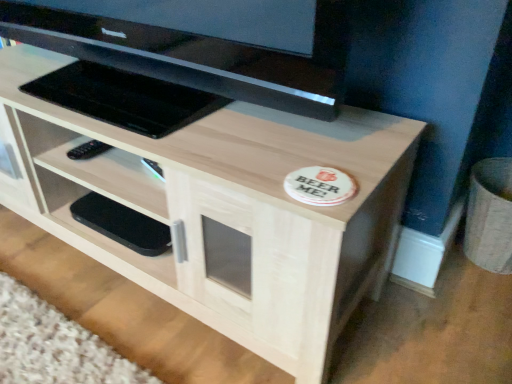
Identify the location of free spot below black glossy television at upper center (from a real-world perspective). The image size is (512, 384). (135, 107).